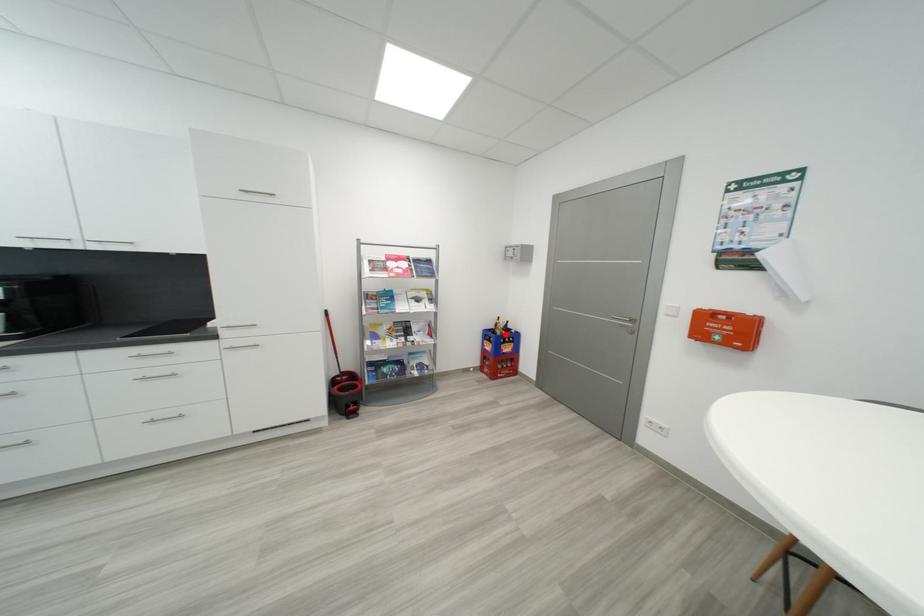
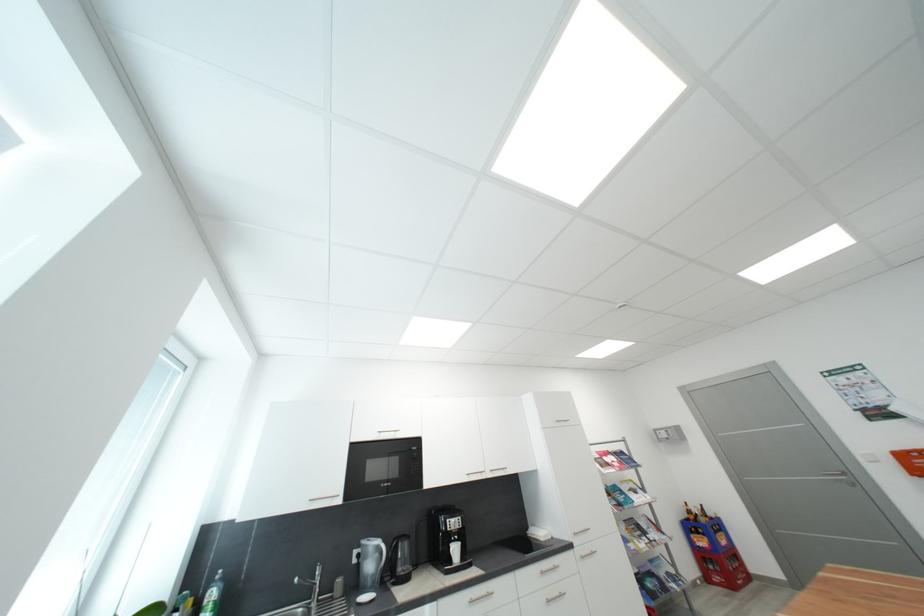
Question: I am providing you with two images of the same scene from different viewpoints. In image1, a red point is highlighted. Considering the same 3D point in image2, which of the following is correct?

Choices:
 (A) It is closer
 (B) It is farther

Answer: (A)